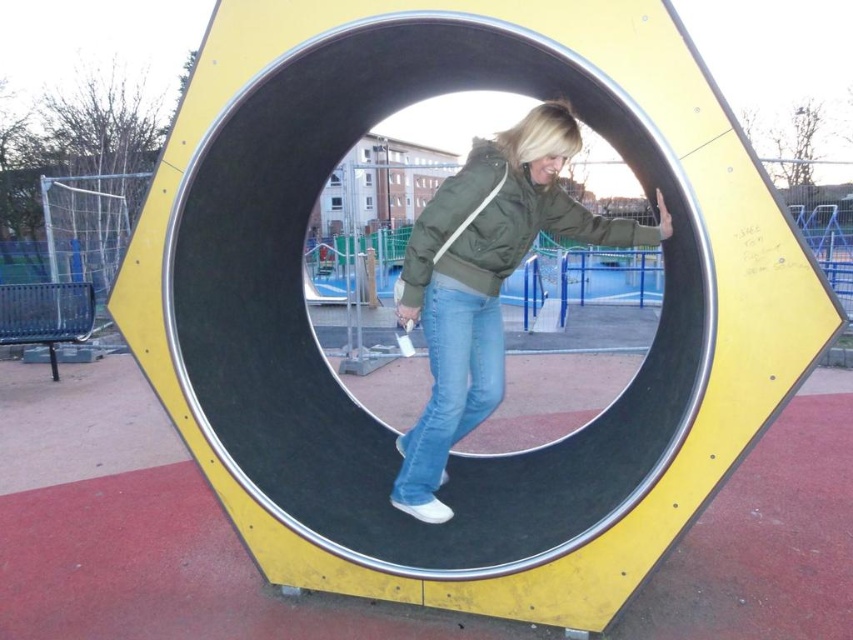
Question: Does matte green jacket at center appear on the right side of green matte jacket at center?

Choices:
 (A) yes
 (B) no

Answer: (B)

Question: From the image, what is the correct spatial relationship of matte green jacket at center in relation to green matte jacket at center?

Choices:
 (A) right
 (B) left

Answer: (B)

Question: Is the position of matte green jacket at center less distant than that of green matte jacket at center?

Choices:
 (A) yes
 (B) no

Answer: (A)

Question: Which point is closer to the camera?

Choices:
 (A) (486, 144)
 (B) (511, 269)

Answer: (A)

Question: Among these points, which one is farthest from the camera?

Choices:
 (A) (572, 147)
 (B) (454, 278)

Answer: (B)